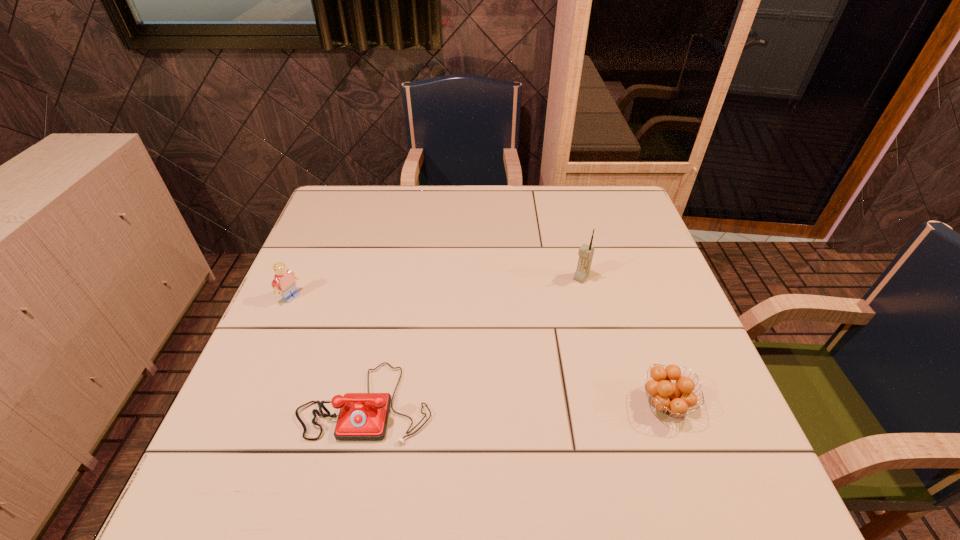
Where is `free space between the second object from right to left and the Lego`? This screenshot has height=540, width=960. free space between the second object from right to left and the Lego is located at coordinates (436, 287).

This screenshot has width=960, height=540. Identify the location of blank region between the orange fruit and the third object from right to left. (516, 403).

Where is `empty space between the second object from left to right and the Lego`? empty space between the second object from left to right and the Lego is located at coordinates [329, 349].

Locate an element on the screen. vacant area that lies between the farthest object and the third object from right to left is located at coordinates (473, 340).

Find the location of `empty space between the third object from right to left and the rightmost object`. empty space between the third object from right to left and the rightmost object is located at coordinates pos(516,403).

The image size is (960, 540). I want to click on free space between the Lego and the telephone, so click(x=329, y=349).

Identify the location of the second closest object to the third shortest object. Image resolution: width=960 pixels, height=540 pixels. (586, 252).

Identify the location of object that is the third nearest to the second tallest object. (673, 398).

Locate an element on the screen. The image size is (960, 540). free location that satisfies the following two spatial constraints: 1. on the front side of the cellular telephone; 2. on the right side of the rightmost object is located at coordinates (612, 404).